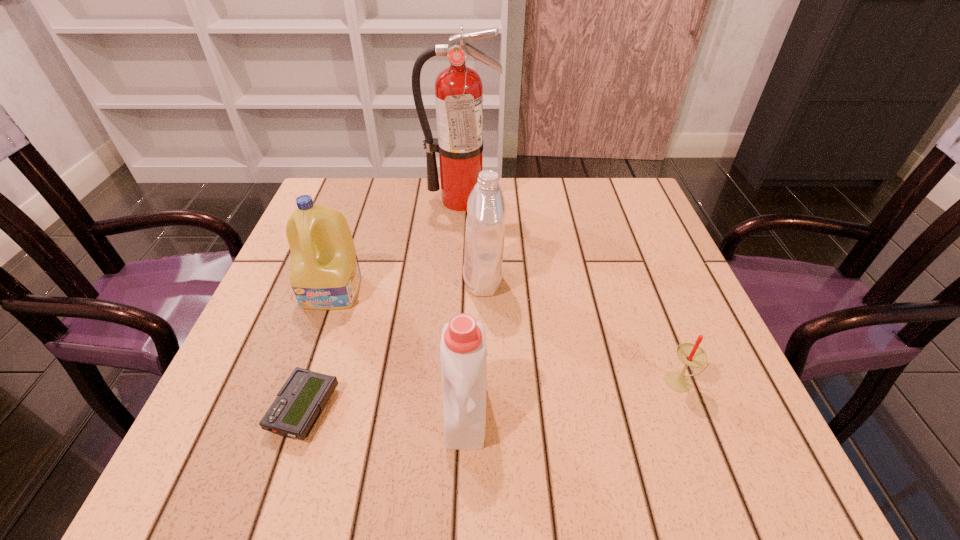
What are the coordinates of `object that is the second closest to the nearest detergent` in the screenshot? It's located at (486, 208).

Find the location of a particular element. the closest detergent to the beeper is located at coordinates (324, 271).

Choose which detergent is the nearest neighbor to the nearest detergent. Please provide its 2D coordinates. Your answer should be formatted as a tuple, i.e. [(x, y)], where the tuple contains the x and y coordinates of a point satisfying the conditions above.

[(486, 208)]